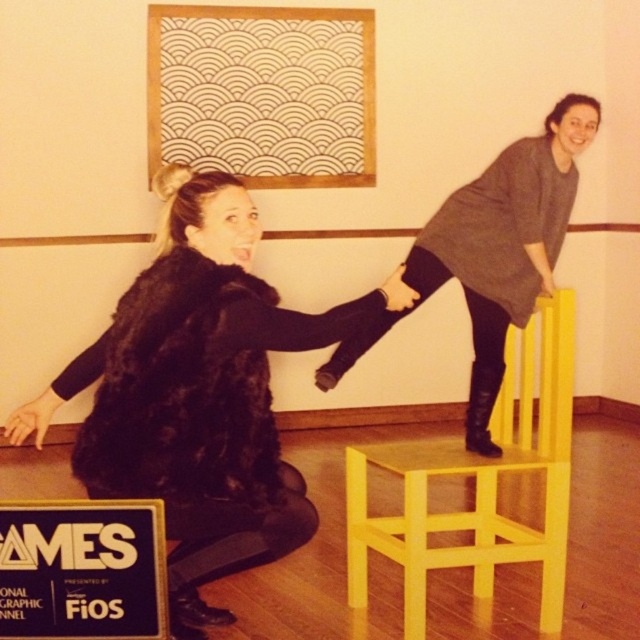
Question: Estimate the real-world distances between objects in this image. Which object is farther from the smooth black hand at lower left?

Choices:
 (A) yellow matte chair at upper right
 (B) black fur coat at lower left

Answer: (A)

Question: Which point is farther from the camera taking this photo?

Choices:
 (A) (28, 420)
 (B) (552, 289)
 (C) (154, 400)
 (D) (412, 560)

Answer: (B)

Question: Which object is positioned farthest from the smooth black hand at lower left?

Choices:
 (A) black furry coat at lower left
 (B) black fur coat at lower left
 (C) yellow matte chair at upper right

Answer: (C)

Question: Does yellow matte chair at upper right appear under matte black hand at upper center?

Choices:
 (A) yes
 (B) no

Answer: (A)

Question: Can you confirm if black fur coat at lower left is positioned above matte black hand at upper center?

Choices:
 (A) no
 (B) yes

Answer: (A)

Question: Is black furry coat at lower left to the left of matte black hand at upper center from the viewer's perspective?

Choices:
 (A) no
 (B) yes

Answer: (B)